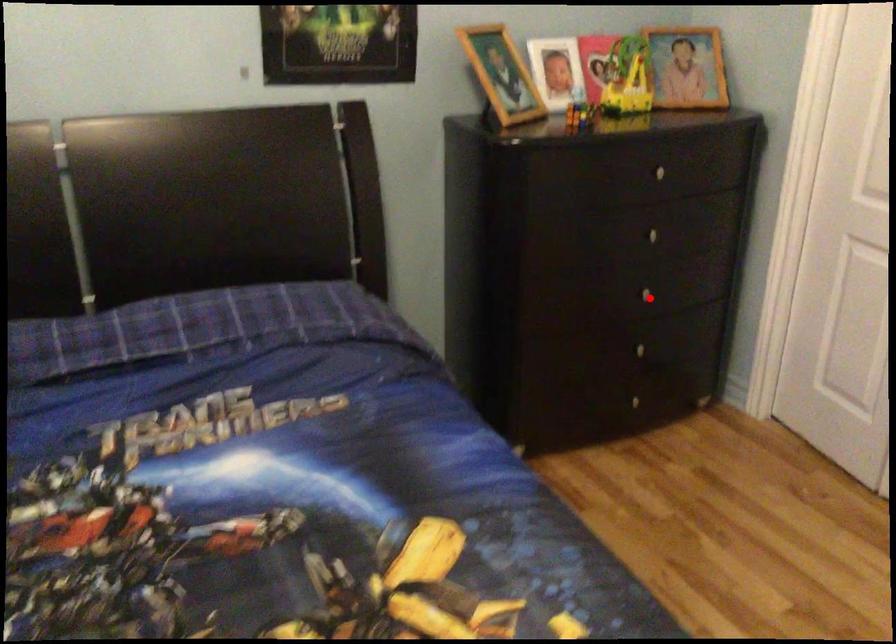
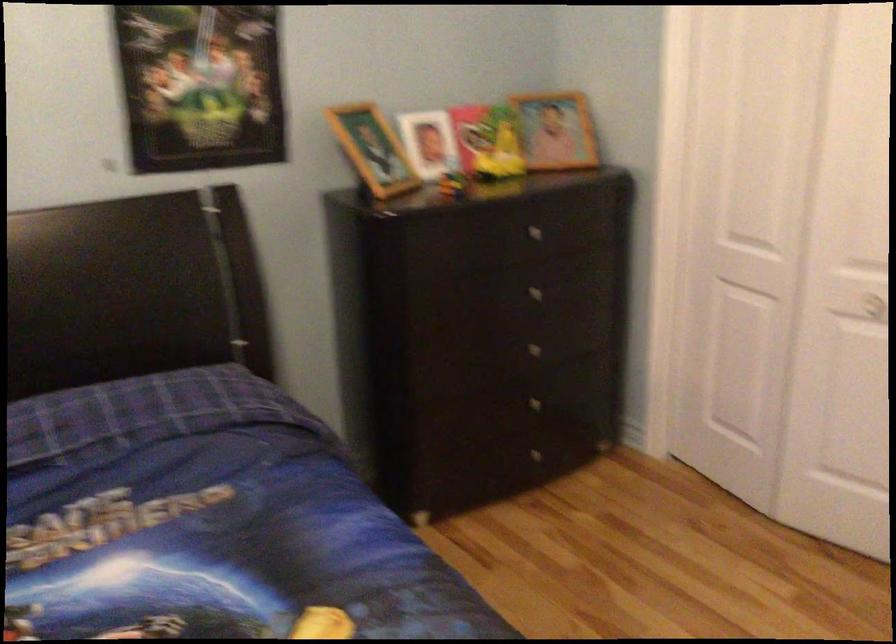
In the second image, find the point that corresponds to the highlighted location in the first image.

(539, 353)